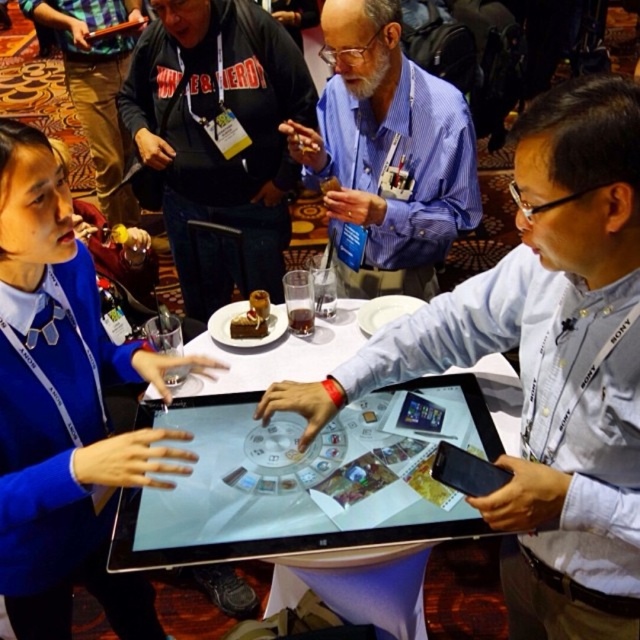
You are a photographer at the event and need to capture a photo of both the blue fabric sweater at center and the blue shirt at center. Which one should you focus on first to ensure it appears larger in the photo?

The blue fabric sweater at center is much taller than the blue shirt at center, so focusing on it first will ensure it appears larger in the photo.

You are attending a conference and need to choose a seat between the brushed metal jacket at upper center and the matte black hoodie at upper left. Which seat is closer to the interactive display on the table?

The brushed metal jacket at upper center is closer to the interactive display on the table because it is positioned at upper center, which is closer to the table compared to the matte black hoodie at upper left.

You are a participant at this conference. You need to place a protective cover over the silver glossy tablet at center and the black glossy tablet at center. Which tablet requires a taller cover?

The silver glossy tablet at center requires a taller cover because it is taller than the black glossy tablet at center.